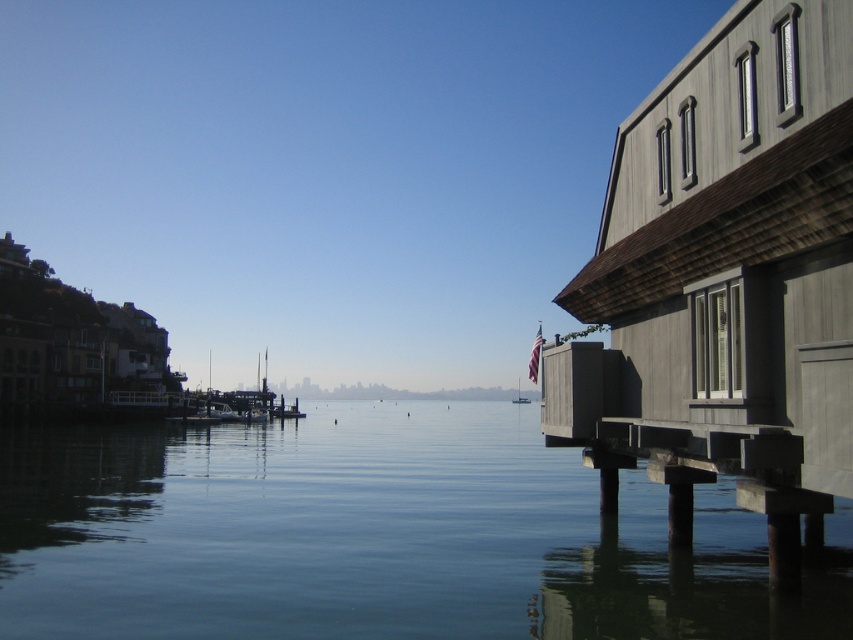
Question: Is the position of clear water at center more distant than that of white plastic boat at center?

Choices:
 (A) no
 (B) yes

Answer: (A)

Question: Does clear water at center have a larger size compared to white plastic boat at center?

Choices:
 (A) yes
 (B) no

Answer: (A)

Question: Which point appears farthest from the camera in this image?

Choices:
 (A) (47, 564)
 (B) (515, 401)

Answer: (B)

Question: From the image, what is the correct spatial relationship of clear water at center in relation to white plastic boat at center?

Choices:
 (A) right
 (B) left

Answer: (B)

Question: Which point is farther to the camera?

Choices:
 (A) clear water at center
 (B) white plastic boat at center

Answer: (B)

Question: Which point is farther to the camera?

Choices:
 (A) (33, 474)
 (B) (521, 397)

Answer: (B)